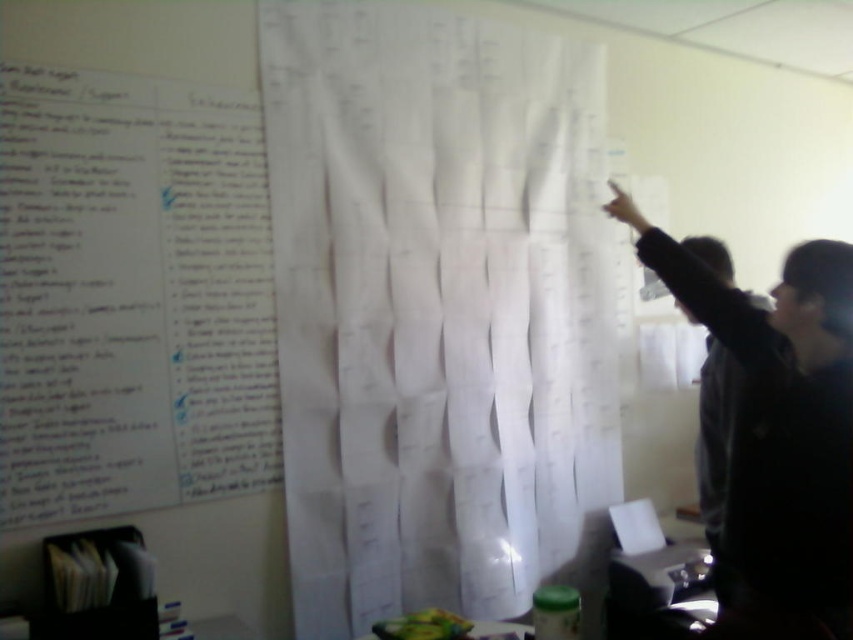
Question: Which point is farther to the camera?

Choices:
 (A) pyautogui.click(x=608, y=182)
 (B) pyautogui.click(x=489, y=556)

Answer: (A)

Question: From the image, what is the correct spatial relationship of white paper curtain at upper center in relation to white paper at upper left?

Choices:
 (A) right
 (B) left

Answer: (A)

Question: Considering the relative positions of white paper curtain at upper center and white paper at upper left in the image provided, where is white paper curtain at upper center located with respect to white paper at upper left?

Choices:
 (A) left
 (B) right

Answer: (B)

Question: Which object appears farthest from the camera in this image?

Choices:
 (A) white paper at upper left
 (B) white paper curtain at upper center
 (C) black fabric at upper right

Answer: (B)

Question: Is white paper at upper left above black fabric at upper right?

Choices:
 (A) no
 (B) yes

Answer: (B)

Question: Which point appears farthest from the camera in this image?

Choices:
 (A) (51, 515)
 (B) (804, 300)
 (C) (386, 230)

Answer: (C)